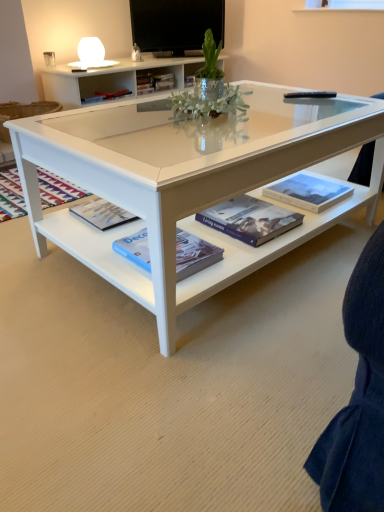
You are a GUI agent. You are given a task and a screenshot of the screen. Output one action in this format:
    pyautogui.click(x=<x>, y=<y>)
    Task: Click on the free space above hardcover book at center, placed as the 3th book when sorted from top to bottom (from a real-world perspective)
    This screenshot has width=384, height=512.
    Given the screenshot: What is the action you would take?
    pyautogui.click(x=233, y=211)